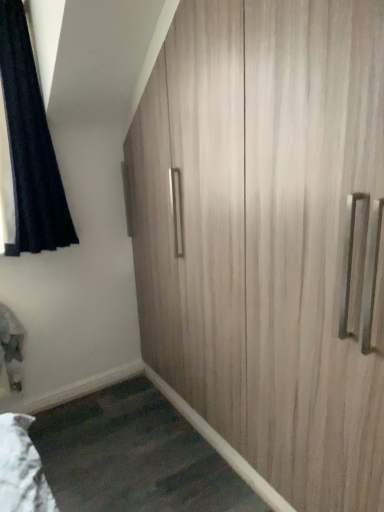
Locate an element on the screen. The height and width of the screenshot is (512, 384). light wood cupboard at center is located at coordinates (269, 236).

This screenshot has width=384, height=512. What do you see at coordinates (269, 236) in the screenshot? I see `light wood cupboard at center` at bounding box center [269, 236].

The width and height of the screenshot is (384, 512). What do you see at coordinates (27, 149) in the screenshot?
I see `black velvet curtain at upper left` at bounding box center [27, 149].

Identify the location of black velvet curtain at upper left. The width and height of the screenshot is (384, 512). (27, 149).

Measure the distance between point (26, 72) and camera.

Point (26, 72) and camera are 1.90 meters apart.

Locate an element on the screen. The image size is (384, 512). light wood cupboard at center is located at coordinates (269, 236).

Is light wood cupboard at center to the left of black velvet curtain at upper left from the viewer's perspective?

No.

Who is more distant, light wood cupboard at center or black velvet curtain at upper left?

black velvet curtain at upper left is further away from the camera.

Is point (260, 128) closer or farther from the camera than point (57, 175)?

Clearly, point (260, 128) is closer to the camera than point (57, 175).

From the image's perspective, does light wood cupboard at center appear higher than black velvet curtain at upper left?

No, from the image's perspective, light wood cupboard at center is not on top of black velvet curtain at upper left.

From a real-world perspective, is light wood cupboard at center located beneath black velvet curtain at upper left?

Yes, from a real-world perspective, light wood cupboard at center is under black velvet curtain at upper left.

In terms of width, does light wood cupboard at center look wider or thinner when compared to black velvet curtain at upper left?

In the image, light wood cupboard at center appears to be more narrow than black velvet curtain at upper left.

Between light wood cupboard at center and black velvet curtain at upper left, which one has less height?

With less height is black velvet curtain at upper left.

Considering the relative sizes of light wood cupboard at center and black velvet curtain at upper left in the image provided, is light wood cupboard at center bigger than black velvet curtain at upper left?

Yes, light wood cupboard at center is bigger than black velvet curtain at upper left.

Is light wood cupboard at center positioned beyond the bounds of black velvet curtain at upper left?

Yes.

Are light wood cupboard at center and black velvet curtain at upper left beside each other?

No, light wood cupboard at center is not touching black velvet curtain at upper left.

Could you tell me if light wood cupboard at center is turned towards black velvet curtain at upper left?

Yes, light wood cupboard at center is aimed at black velvet curtain at upper left.

How far apart are light wood cupboard at center and black velvet curtain at upper left?

94.58 centimeters.

This screenshot has height=512, width=384. Find the location of `curtain positioned vertically above the light wood cupboard at center (from a real-world perspective)`. curtain positioned vertically above the light wood cupboard at center (from a real-world perspective) is located at coordinates (27, 149).

Which object is positioned more to the right, black velvet curtain at upper left or light wood cupboard at center?

light wood cupboard at center.

Is black velvet curtain at upper left positioned before light wood cupboard at center?

No, it is behind light wood cupboard at center.

Consider the image. Which point is more forward, (45,242) or (314,211)?

Point (314,211)

From the image's perspective, would you say black velvet curtain at upper left is positioned over light wood cupboard at center?

Yes, from the image's perspective, black velvet curtain at upper left is over light wood cupboard at center.

From a real-world perspective, is black velvet curtain at upper left positioned above or below light wood cupboard at center?

Clearly, from a real-world perspective, black velvet curtain at upper left is above light wood cupboard at center.

Is black velvet curtain at upper left wider than light wood cupboard at center?

Yes.

Does black velvet curtain at upper left have a lesser height compared to light wood cupboard at center?

Yes, black velvet curtain at upper left is shorter than light wood cupboard at center.

Based on the photo, can you confirm if black velvet curtain at upper left is bigger than light wood cupboard at center?

No.

Is light wood cupboard at center inside black velvet curtain at upper left?

No, light wood cupboard at center is not surrounded by black velvet curtain at upper left.

Consider the image. Are black velvet curtain at upper left and light wood cupboard at center beside each other?

No.

Does black velvet curtain at upper left turn towards light wood cupboard at center?

No, black velvet curtain at upper left is not facing towards light wood cupboard at center.

How many degrees apart are the facing directions of black velvet curtain at upper left and light wood cupboard at center?

90.1 degrees.

In order to click on curtain on the left of light wood cupboard at center in this screenshot , I will do `click(27, 149)`.

Where is `curtain above the light wood cupboard at center (from the image's perspective)`? curtain above the light wood cupboard at center (from the image's perspective) is located at coordinates (27, 149).

This screenshot has height=512, width=384. In order to click on curtain on the left side of light wood cupboard at center in this screenshot , I will do `click(27, 149)`.